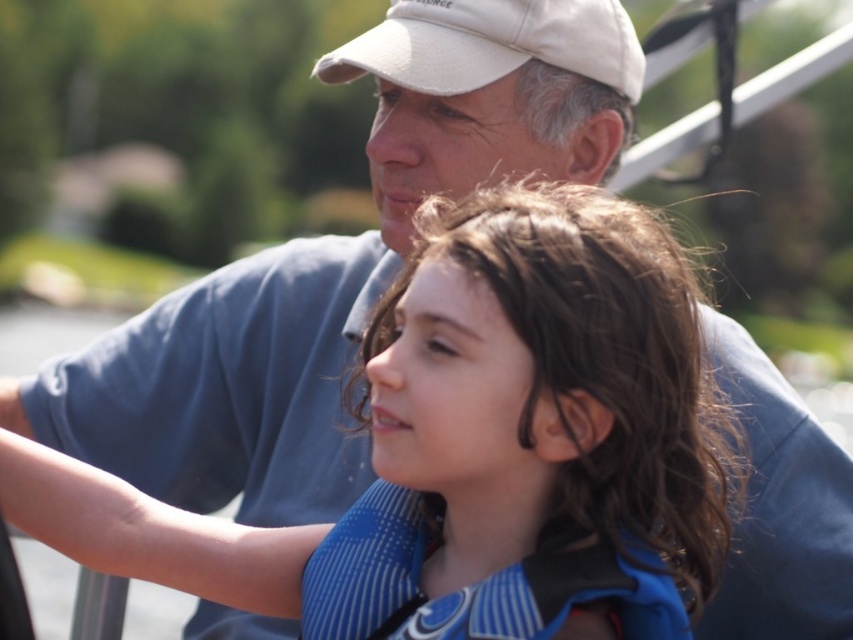
You are a photographer trying to capture a candid shot of the wet hair at center and the white matte baseball cap at upper center. Since the background is blurred, can you tell which object is closer to the camera based on their positions?

The wet hair at center is closer to the camera than the white matte baseball cap at upper center because it is positioned in front of it.

You are a photographer trying to capture a candid shot of the wet hair at center and the white matte baseball cap at upper center. If your camera can focus on objects within 25 inches of each other, will both subjects be in focus?

The wet hair at center is 27.73 inches from the white matte baseball cap at upper center. Since the distance exceeds the camera focus range of 25 inches, both subjects will not be in focus simultaneously.